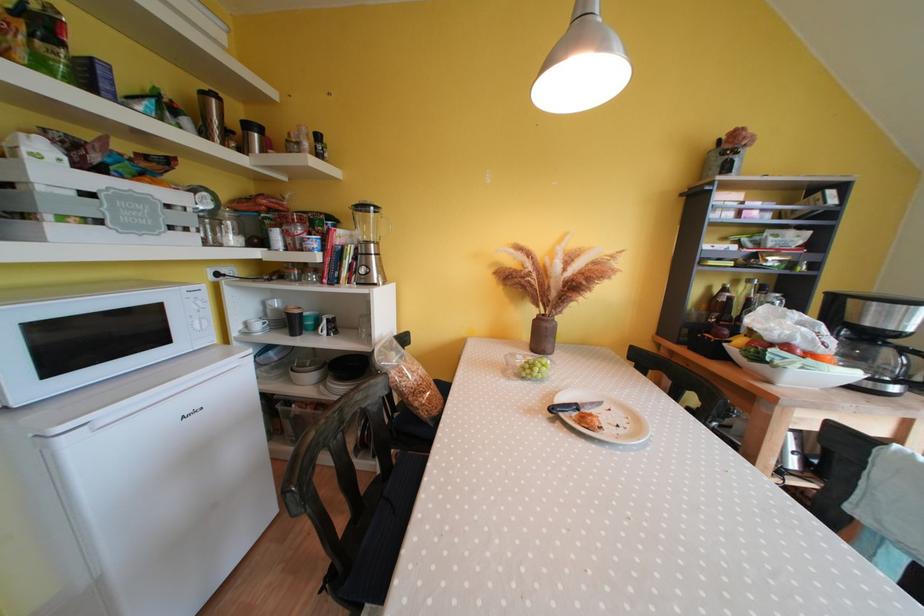
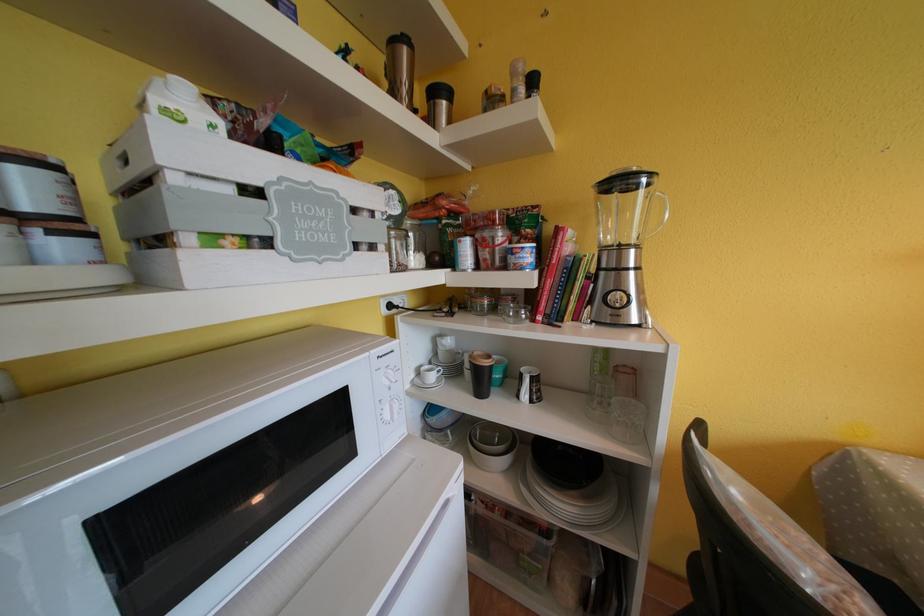
Where in the second image is the point corresponding to the point at 252,130 from the first image?

(440, 95)